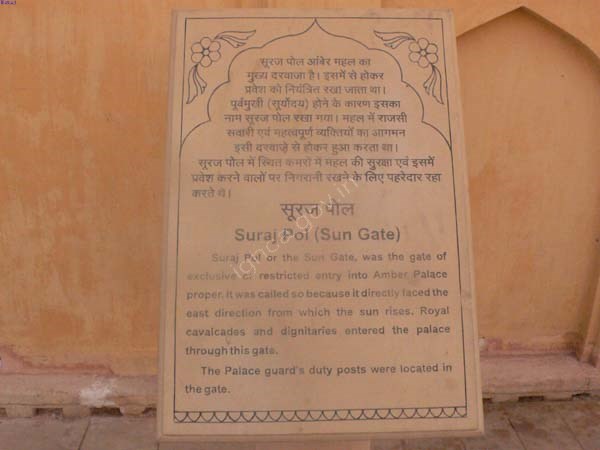
Where is `stained floor`? stained floor is located at coordinates (24, 436), (129, 440), (563, 423), (495, 438).